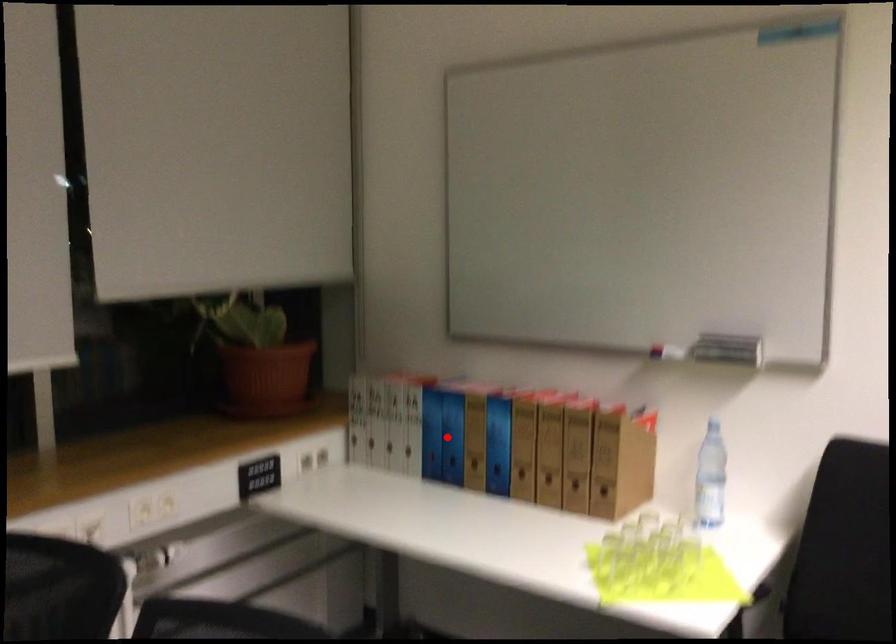
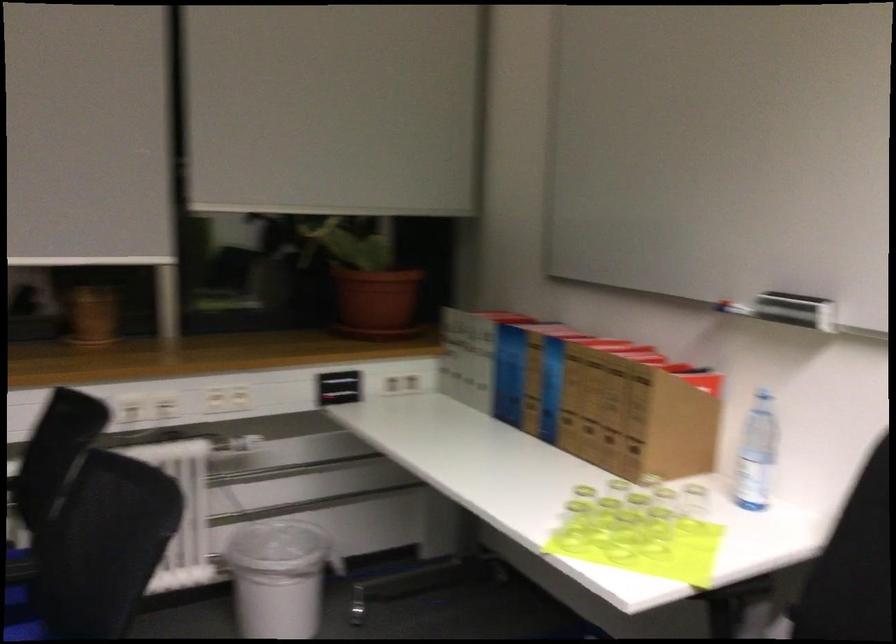
In the second image, find the point that corresponds to the highlighted location in the first image.

(509, 374)